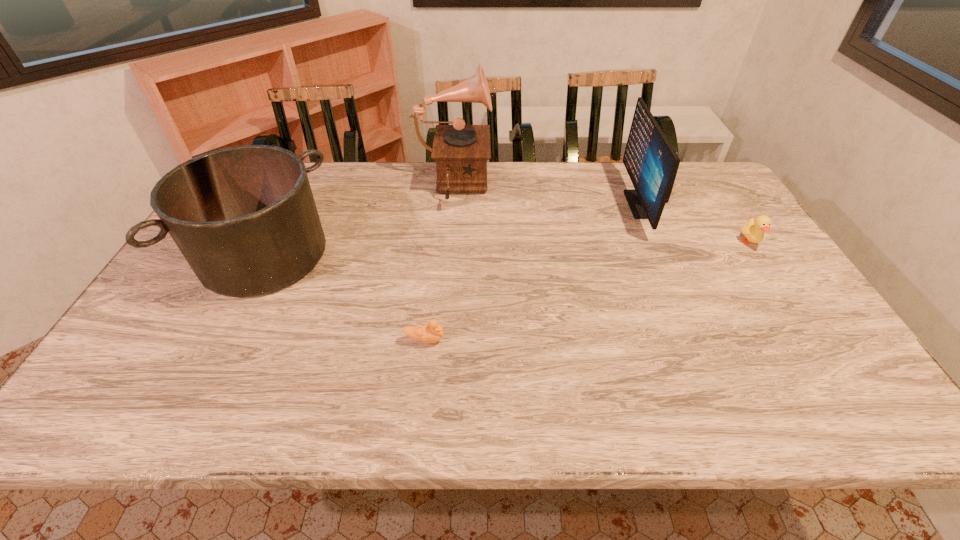
Where is `free space between the record player and the second shortest object`? free space between the record player and the second shortest object is located at coordinates (601, 214).

The height and width of the screenshot is (540, 960). Identify the location of free space between the rightmost object and the pan. (507, 249).

Identify the location of free space between the taller duckling and the pan. (507, 249).

Locate an element on the screen. free space between the second object from right to left and the second shortest object is located at coordinates (695, 224).

Find the location of a particular element. object that is the closest to the shorter duckling is located at coordinates (244, 217).

Locate an element on the screen. This screenshot has height=540, width=960. object that can be found as the fourth closest to the taller duckling is located at coordinates (244, 217).

In order to click on vacant region that satisfies the following two spatial constraints: 1. on the horn of the record player; 2. on the front side of the leftmost object in this screenshot , I will do `click(447, 255)`.